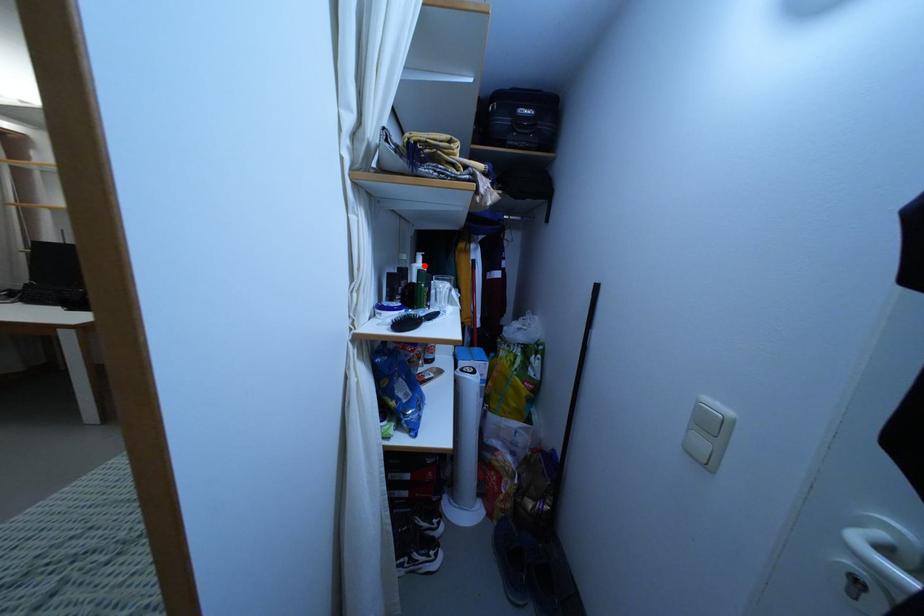
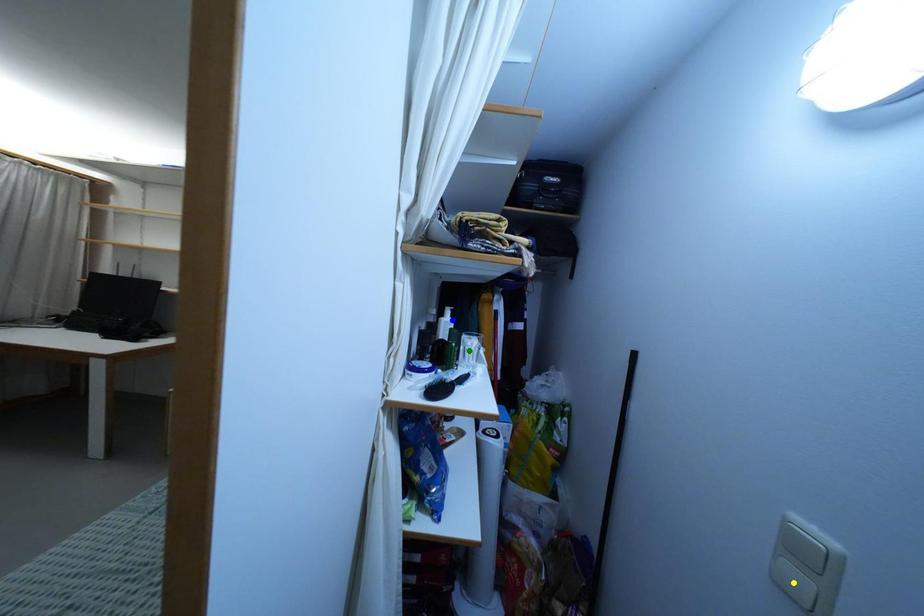
Question: I am providing you with two images of the same scene from different viewpoints. A red point is marked on the first image. You are given multiple points on the second image. In image 2, which mark is for the same physical point as the one in image 1?

Choices:
 (A) blue point
 (B) green point
 (C) yellow point

Answer: (A)